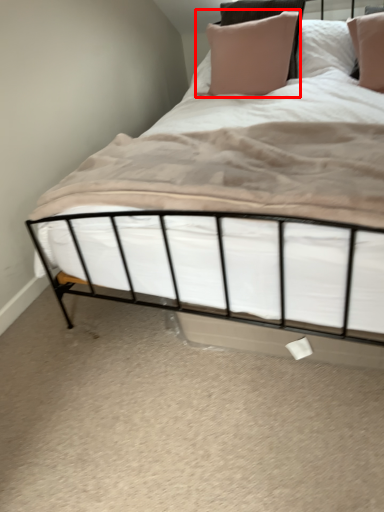
Question: From the image's perspective, what is the correct spatial positioning of pillow (annotated by the red box) in reference to sheet?

Choices:
 (A) below
 (B) above

Answer: (B)